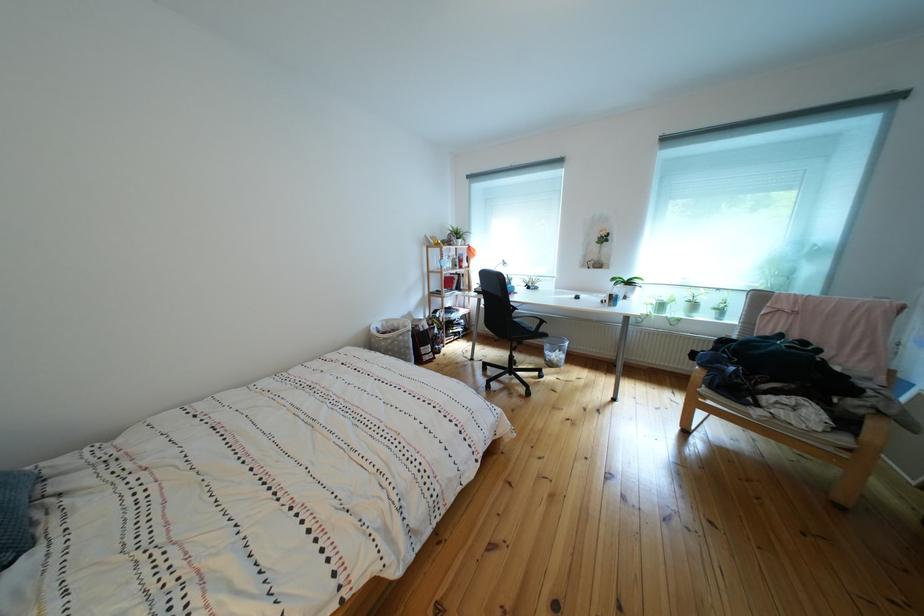
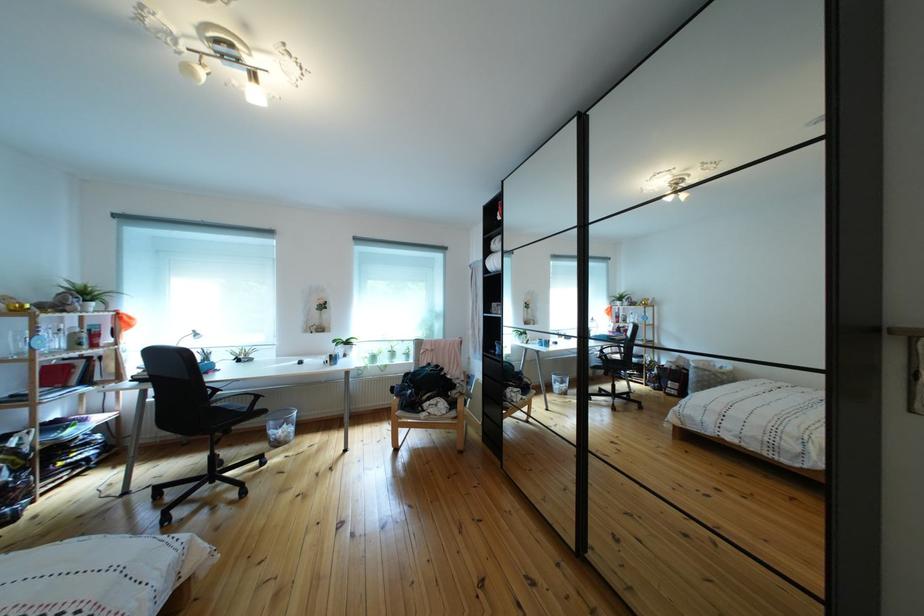
Question: The images are taken continuously from a first-person perspective. In which direction is your viewpoint rotating?

Choices:
 (A) Left
 (B) Right
 (C) Up
 (D) Down

Answer: (B)